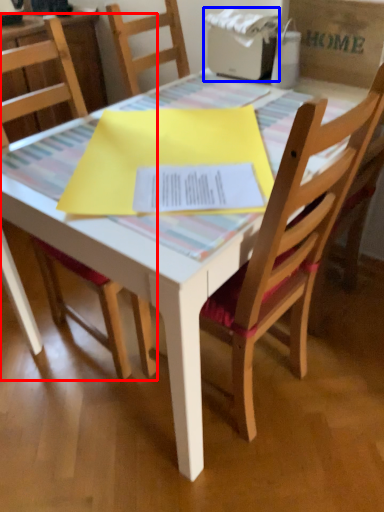
Question: Which object appears farthest to the camera in this image, chair (highlighted by a red box) or printer (highlighted by a blue box)?

Choices:
 (A) chair
 (B) printer

Answer: (B)